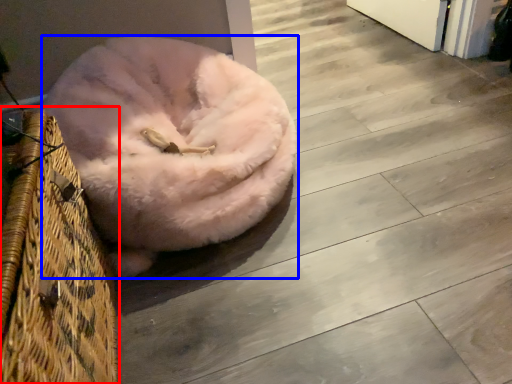
Question: Among these objects, which one is nearest to the camera, basket (highlighted by a red box) or dog bed (highlighted by a blue box)?

Choices:
 (A) basket
 (B) dog bed

Answer: (A)